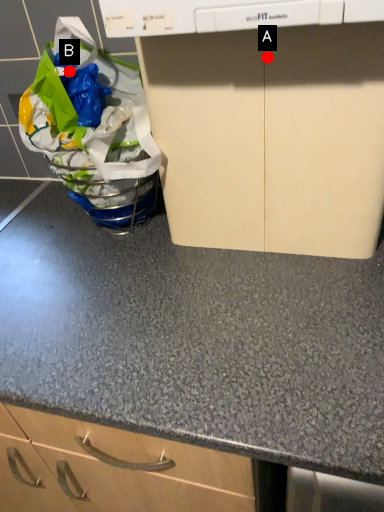
Question: Two points are circled on the image, labeled by A and B beside each circle. Which point is farther to the camera?

Choices:
 (A) A is further
 (B) B is further

Answer: (B)